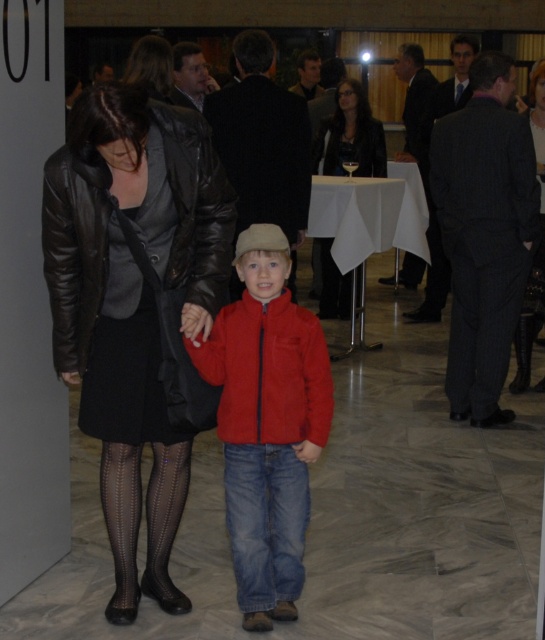
Does leather jacket at center have a larger size compared to black mesh tights at lower left?

Yes.

What do you see at coordinates (136, 307) in the screenshot? The height and width of the screenshot is (640, 545). I see `leather jacket at center` at bounding box center [136, 307].

Find the location of `leather jacket at center`. leather jacket at center is located at coordinates (136, 307).

Who is lower down, red fleece jacket at center or shiny black leather jacket at upper left?

red fleece jacket at center is below.

Is the position of red fleece jacket at center more distant than that of shiny black leather jacket at upper left?

No, red fleece jacket at center is in front of shiny black leather jacket at upper left.

Who is more forward, (239, 435) or (136, 64)?

Point (239, 435) is more forward.

Where is `red fleece jacket at center`? The image size is (545, 640). red fleece jacket at center is located at coordinates (267, 422).

Describe the element at coordinates (265, 522) in the screenshot. I see `denim jeans at center` at that location.

Is denim jeans at center above matte black dress at center?

No.

Is point (270, 499) less distant than point (541, 208)?

That is True.

At what (x,y) coordinates should I click in order to perform the action: click on denim jeans at center. Please return your answer as a coordinate pair (x, y). The width and height of the screenshot is (545, 640). Looking at the image, I should click on (265, 522).